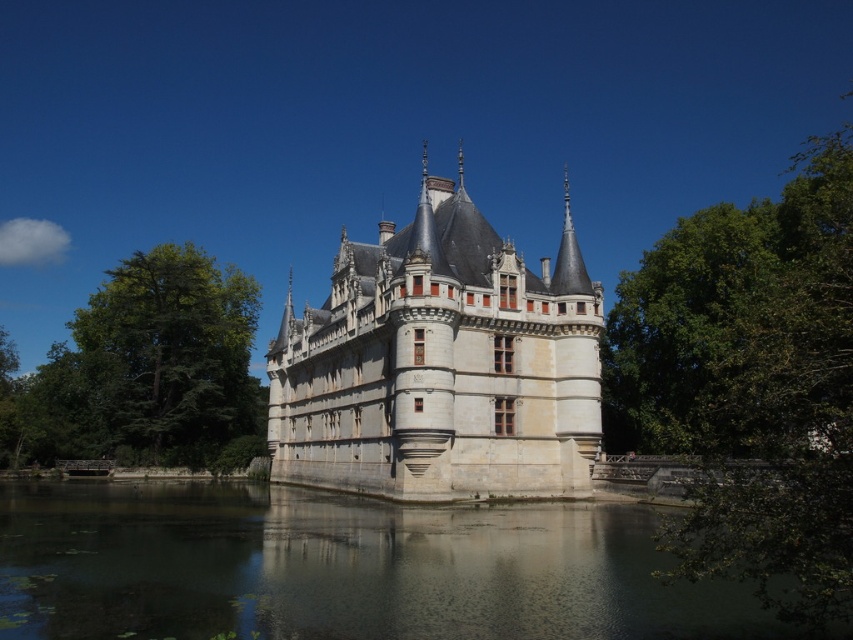
Question: Estimate the real-world distances between objects in this image. Which object is closer to the stone castle at center?

Choices:
 (A) transparent water at lower center
 (B) green leafy tree at left

Answer: (A)

Question: Observing the image, what is the correct spatial positioning of transparent water at lower center in reference to green leafy tree at right?

Choices:
 (A) above
 (B) below

Answer: (B)

Question: Does stone castle at center appear under green leafy tree at left?

Choices:
 (A) yes
 (B) no

Answer: (B)

Question: Is green leafy tree at right smaller than stone castle at center?

Choices:
 (A) no
 (B) yes

Answer: (A)

Question: Which point is closer to the camera taking this photo?

Choices:
 (A) (387, 355)
 (B) (242, 365)
 (C) (54, 624)

Answer: (C)

Question: Which point is farther to the camera?

Choices:
 (A) stone castle at center
 (B) green leafy tree at right
 (C) transparent water at lower center

Answer: (A)